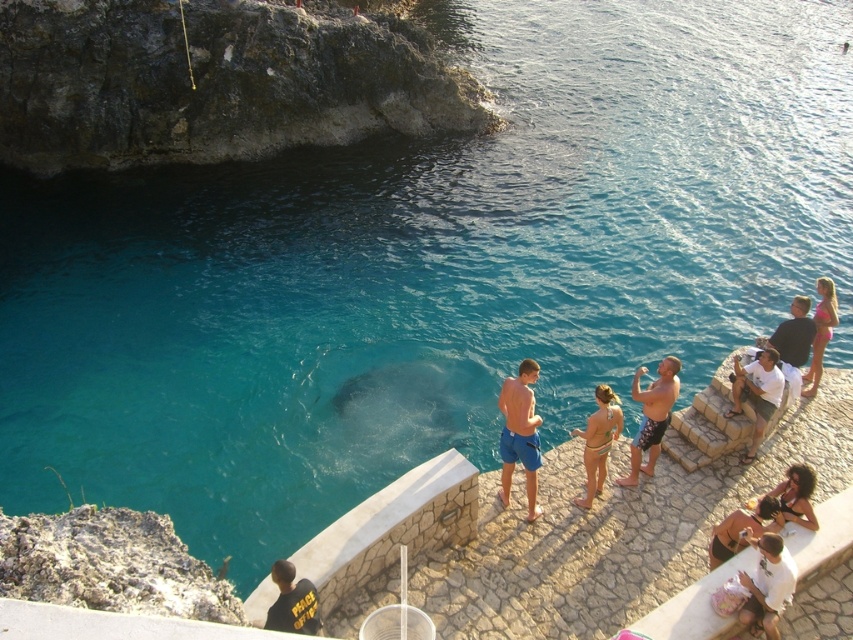
Does printed swim trunks at center come behind dark blue shorts at right?

No.

Does point (677, 360) come in front of point (790, 372)?

Yes.

Is point (641, 429) farther from camera compared to point (787, 396)?

No, (641, 429) is closer to viewer.

Find the location of a particular element. This screenshot has width=853, height=640. printed swim trunks at center is located at coordinates (651, 417).

Can you confirm if dark gray rock at upper left is positioned to the right of dark blue shorts at right?

No, dark gray rock at upper left is not to the right of dark blue shorts at right.

Which is in front, point (163, 148) or point (804, 321)?

Positioned in front is point (804, 321).

The height and width of the screenshot is (640, 853). In order to click on dark gray rock at upper left in this screenshot , I will do `click(215, 81)`.

The image size is (853, 640). Identify the location of multicolored bikini at center. (598, 440).

Describe the element at coordinates (598, 440) in the screenshot. I see `multicolored bikini at center` at that location.

Is point (589, 464) closer to viewer compared to point (734, 522)?

No, it is behind (734, 522).

The width and height of the screenshot is (853, 640). I want to click on multicolored bikini at center, so click(x=598, y=440).